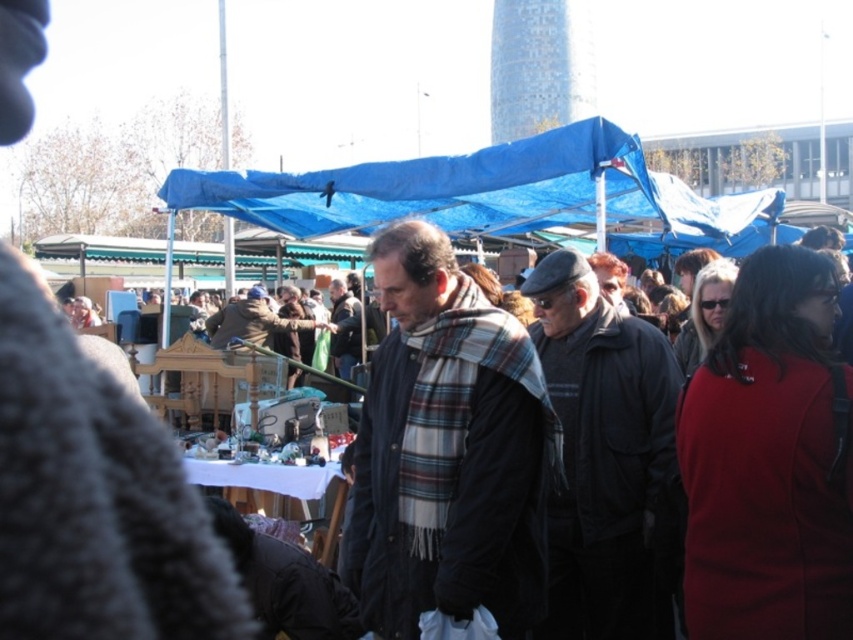
Question: Among these objects, which one is farthest from the camera?

Choices:
 (A) plaid scarf at center
 (B) blue tarpaulin canopy at upper center
 (C) dark gray woolen jacket at center

Answer: (B)

Question: Does plaid scarf at center appear on the left side of dark gray woolen jacket at center?

Choices:
 (A) no
 (B) yes

Answer: (B)

Question: Does plaid scarf at center come in front of dark gray woolen jacket at center?

Choices:
 (A) yes
 (B) no

Answer: (A)

Question: Which is nearer to the blue tarpaulin canopy at upper center?

Choices:
 (A) dark gray woolen jacket at center
 (B) plaid scarf at center

Answer: (A)

Question: Does dark gray woolen jacket at center lie behind blue tarpaulin canopy at upper center?

Choices:
 (A) yes
 (B) no

Answer: (B)

Question: Which object appears closest to the camera in this image?

Choices:
 (A) plaid scarf at center
 (B) dark gray woolen jacket at center
 (C) blue tarpaulin canopy at upper center

Answer: (A)